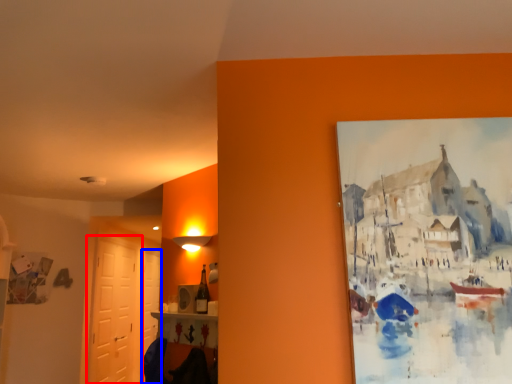
Question: Among these objects, which one is nearest to the camera, door (highlighted by a red box) or door (highlighted by a blue box)?

Choices:
 (A) door
 (B) door

Answer: (A)